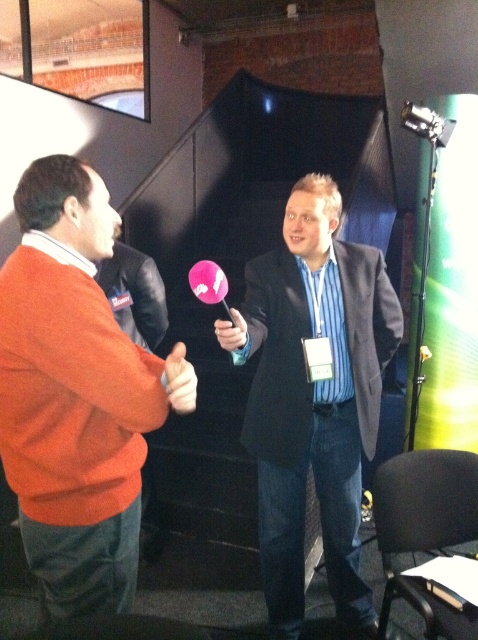
Question: Which object appears farthest from the camera in this image?

Choices:
 (A) black leather jacket at left
 (B) metallic silver microphone at upper right

Answer: (B)

Question: Which of these objects is positioned farthest from the pink matte/metallic microphone at center?

Choices:
 (A) dark blue suit at center
 (B) metallic silver microphone at upper right

Answer: (B)

Question: Which object appears farthest from the camera in this image?

Choices:
 (A) metallic silver microphone at upper right
 (B) dark blue suit at center
 (C) white matte hand at center

Answer: (A)

Question: Does white matte hand at center have a smaller size compared to metallic silver microphone at upper right?

Choices:
 (A) no
 (B) yes

Answer: (B)

Question: Can you confirm if dark blue suit at center is positioned to the right of white matte hand at center?

Choices:
 (A) yes
 (B) no

Answer: (A)

Question: Does black leather jacket at left have a greater width compared to pink matte/metallic microphone at center?

Choices:
 (A) yes
 (B) no

Answer: (A)